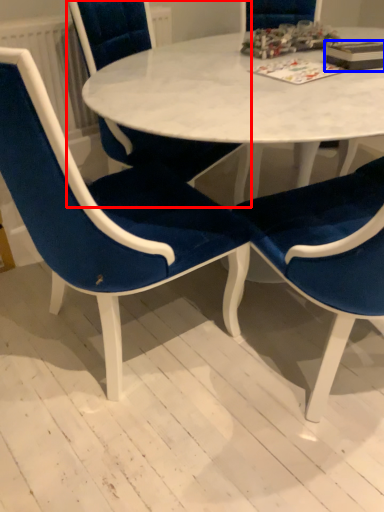
Question: Which point is closer to the camera, chair (highlighted by a red box) or book (highlighted by a blue box)?

Choices:
 (A) chair
 (B) book

Answer: (A)